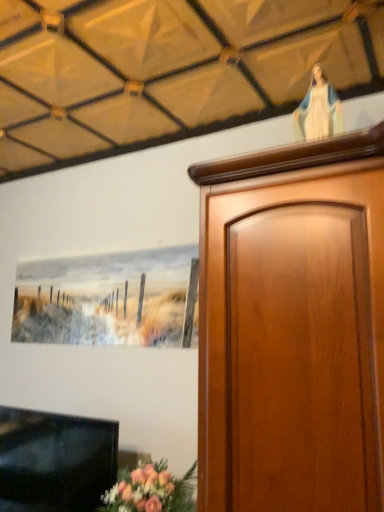
What is the approximate height of white glossy statue at upper right?

The height of white glossy statue at upper right is 12.92 inches.

This screenshot has width=384, height=512. What do you see at coordinates (318, 109) in the screenshot?
I see `white glossy statue at upper right` at bounding box center [318, 109].

The height and width of the screenshot is (512, 384). Find the location of `white glossy statue at upper right`. white glossy statue at upper right is located at coordinates (318, 109).

I want to click on black glossy tv at lower left, so click(x=55, y=461).

Describe the element at coordinates (55, 461) in the screenshot. I see `black glossy tv at lower left` at that location.

This screenshot has width=384, height=512. Identify the location of white glossy statue at upper right. (318, 109).

Is white glossy statue at upper right to the right of black glossy tv at lower left from the viewer's perspective?

Indeed, white glossy statue at upper right is positioned on the right side of black glossy tv at lower left.

Does white glossy statue at upper right lie in front of black glossy tv at lower left?

Yes.

Does point (304, 120) appear closer or farther from the camera than point (41, 462)?

Point (304, 120).

From the image's perspective, which is above, white glossy statue at upper right or black glossy tv at lower left?

From the image's view, white glossy statue at upper right is above.

From a real-world perspective, between white glossy statue at upper right and black glossy tv at lower left, who is vertically lower?

black glossy tv at lower left is physically lower.

Which object is wider, white glossy statue at upper right or black glossy tv at lower left?

black glossy tv at lower left.

Considering the sizes of objects white glossy statue at upper right and black glossy tv at lower left in the image provided, who is taller, white glossy statue at upper right or black glossy tv at lower left?

black glossy tv at lower left.

Does white glossy statue at upper right have a smaller size compared to black glossy tv at lower left?

Indeed, white glossy statue at upper right has a smaller size compared to black glossy tv at lower left.

Is white glossy statue at upper right situated inside black glossy tv at lower left or outside?

white glossy statue at upper right lies outside black glossy tv at lower left.

From the picture: Is white glossy statue at upper right next to black glossy tv at lower left and touching it?

No, white glossy statue at upper right is not in contact with black glossy tv at lower left.

Is black glossy tv at lower left at the back of white glossy statue at upper right?

No.

Image resolution: width=384 pixels, height=512 pixels. What are the coordinates of `woman to the right of black glossy tv at lower left` in the screenshot? It's located at (318, 109).

Between black glossy tv at lower left and white glossy statue at upper right, which one appears on the right side from the viewer's perspective?

white glossy statue at upper right is more to the right.

Considering the positions of objects black glossy tv at lower left and white glossy statue at upper right in the image provided, who is behind, black glossy tv at lower left or white glossy statue at upper right?

black glossy tv at lower left.

Which is in front, point (103, 420) or point (304, 113)?

The point (304, 113) is closer.

From the image's perspective, which object appears higher, black glossy tv at lower left or white glossy statue at upper right?

white glossy statue at upper right appears higher in the image.

From a real-world perspective, is black glossy tv at lower left below white glossy statue at upper right?

Correct, in the physical world, black glossy tv at lower left is lower than white glossy statue at upper right.

Is black glossy tv at lower left thinner than white glossy statue at upper right?

No, black glossy tv at lower left is not thinner than white glossy statue at upper right.

Between black glossy tv at lower left and white glossy statue at upper right, which one has less height?

With less height is white glossy statue at upper right.

Is black glossy tv at lower left bigger than white glossy statue at upper right?

Yes.

Do you think black glossy tv at lower left is within white glossy statue at upper right, or outside of it?

black glossy tv at lower left cannot be found inside white glossy statue at upper right.

Is black glossy tv at lower left far away from white glossy statue at upper right?

That's right, there is a large distance between black glossy tv at lower left and white glossy statue at upper right.

Could you tell me if black glossy tv at lower left is facing white glossy statue at upper right?

No, black glossy tv at lower left is not facing towards white glossy statue at upper right.

How different are the orientations of black glossy tv at lower left and white glossy statue at upper right in degrees?

black glossy tv at lower left and white glossy statue at upper right are facing 3.04 degrees away from each other.

Image resolution: width=384 pixels, height=512 pixels. Identify the location of woman positioned vertically above the black glossy tv at lower left (from a real-world perspective). (318, 109).

Locate an element on the screen. television that is on the left side of white glossy statue at upper right is located at coordinates point(55,461).

Image resolution: width=384 pixels, height=512 pixels. What are the coordinates of `woman that is above the black glossy tv at lower left (from the image's perspective)` in the screenshot? It's located at (318, 109).